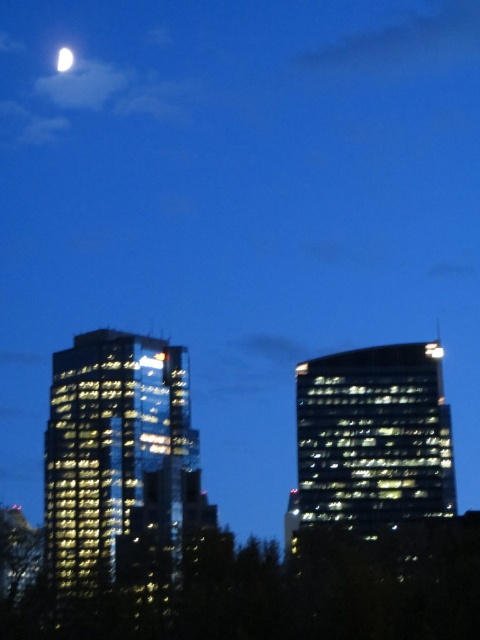
You are an astronomer observing the night sky and notice the glossy glass building at left and the white glossy moon at upper left. From your viewpoint, which object is positioned further to the left?

The white glossy moon at upper left is positioned further to the left than the glossy glass building at left.

You are an architect analyzing the urban layout. Based on the scene, which of the two buildings, the glossy glass building at left or the glossy glass skyscraper at right, is located closer to the ground level?

The glossy glass building at left is positioned under the glossy glass skyscraper at right, meaning it is closer to the ground level.

You are standing in the middle of the street looking at the two skyscrapers. There are two points marked on the buildings. One is at point coordinates point (67, 573) and the other is at point (388, 397). Which point is closer to you?

Point (67, 573) is further to the camera than point (388, 397), so the point closer to you is point (388, 397).